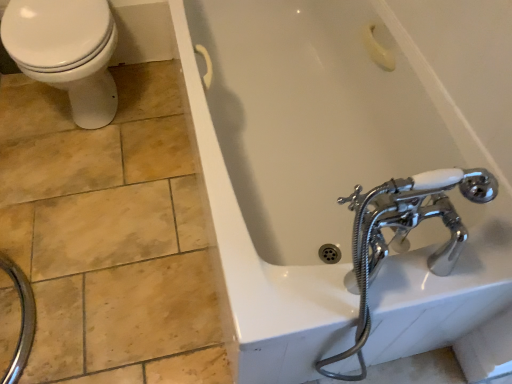
Question: Is white glossy bathtub at upper center positioned behind white glossy toilet at upper left?

Choices:
 (A) no
 (B) yes

Answer: (A)

Question: Considering the relative positions of white glossy bathtub at upper center and white glossy toilet at upper left in the image provided, is white glossy bathtub at upper center to the right of white glossy toilet at upper left from the viewer's perspective?

Choices:
 (A) no
 (B) yes

Answer: (B)

Question: Can you confirm if white glossy bathtub at upper center is thinner than white glossy toilet at upper left?

Choices:
 (A) no
 (B) yes

Answer: (B)

Question: Is white glossy toilet at upper left located within white glossy bathtub at upper center?

Choices:
 (A) no
 (B) yes

Answer: (A)

Question: Can you confirm if white glossy bathtub at upper center is shorter than white glossy toilet at upper left?

Choices:
 (A) yes
 (B) no

Answer: (A)

Question: Does white glossy bathtub at upper center appear on the left side of white glossy toilet at upper left?

Choices:
 (A) no
 (B) yes

Answer: (A)

Question: From the image's perspective, is white glossy toilet at upper left on top of white glossy bathtub at upper center?

Choices:
 (A) yes
 (B) no

Answer: (A)

Question: Is white glossy toilet at upper left shorter than white glossy bathtub at upper center?

Choices:
 (A) yes
 (B) no

Answer: (B)

Question: Considering the relative positions of white glossy toilet at upper left and white glossy bathtub at upper center in the image provided, is white glossy toilet at upper left to the right of white glossy bathtub at upper center from the viewer's perspective?

Choices:
 (A) yes
 (B) no

Answer: (B)

Question: Is white glossy toilet at upper left aimed at white glossy bathtub at upper center?

Choices:
 (A) yes
 (B) no

Answer: (B)

Question: Considering the relative sizes of white glossy toilet at upper left and white glossy bathtub at upper center in the image provided, is white glossy toilet at upper left wider than white glossy bathtub at upper center?

Choices:
 (A) no
 (B) yes

Answer: (B)

Question: Would you say white glossy toilet at upper left is a long distance from white glossy bathtub at upper center?

Choices:
 (A) no
 (B) yes

Answer: (A)

Question: Considering the positions of white glossy toilet at upper left and white glossy bathtub at upper center in the image, is white glossy toilet at upper left taller or shorter than white glossy bathtub at upper center?

Choices:
 (A) short
 (B) tall

Answer: (B)